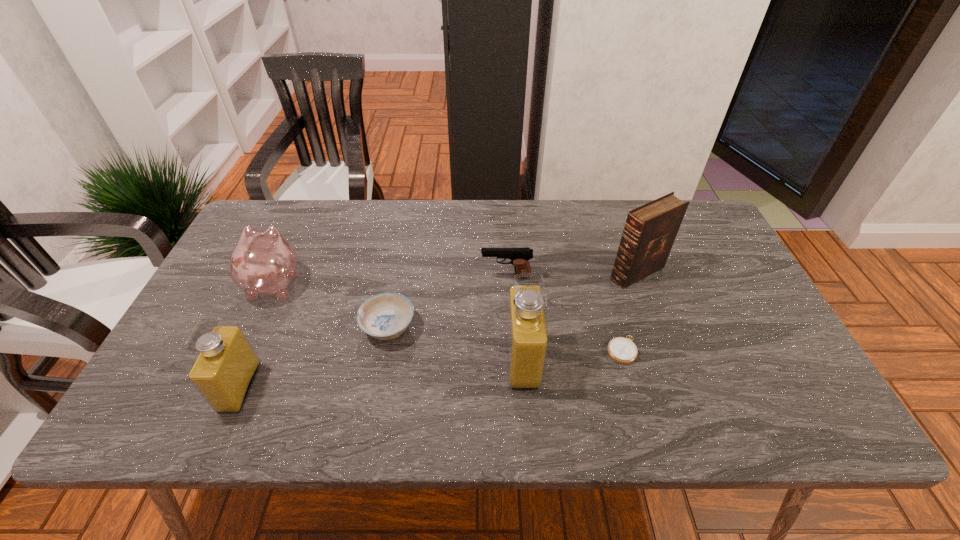
Please point a vacant point for placing a perfume on the right. Please provide its 2D coordinates. Your answer should be formatted as a tuple, i.e. [(x, y)], where the tuple contains the x and y coordinates of a point satisfying the conditions above.

[(779, 335)]